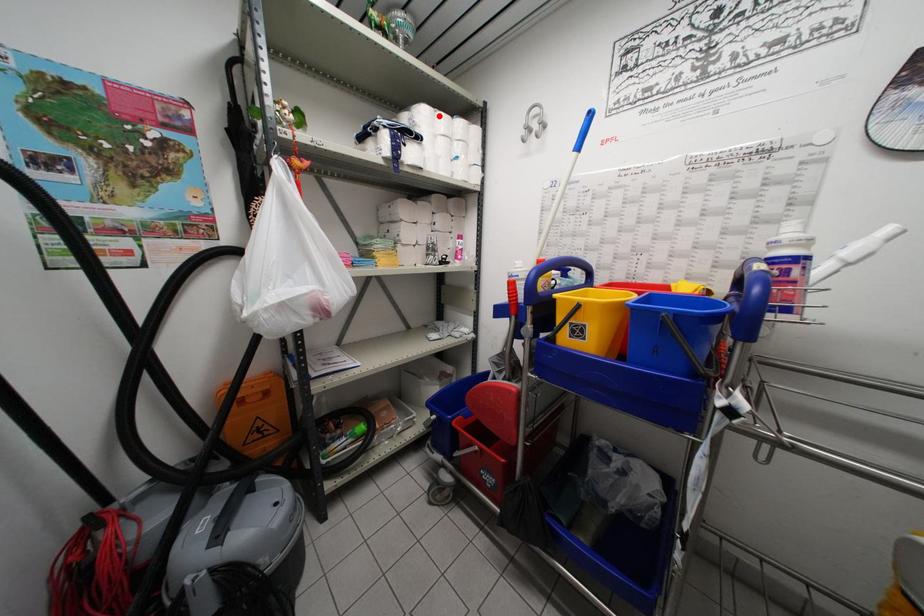
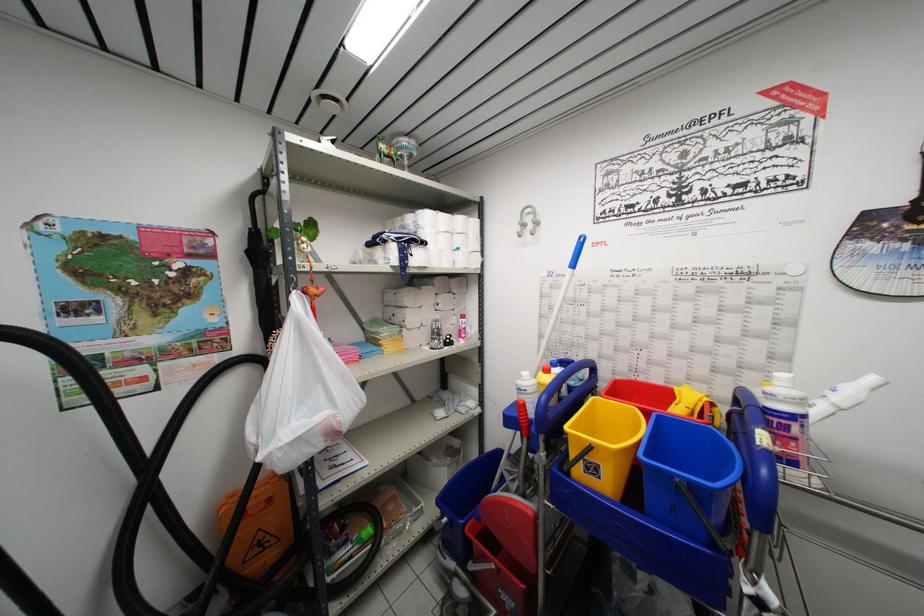
Find the pixel in the second image that matches the highlighted location in the first image.

(441, 217)